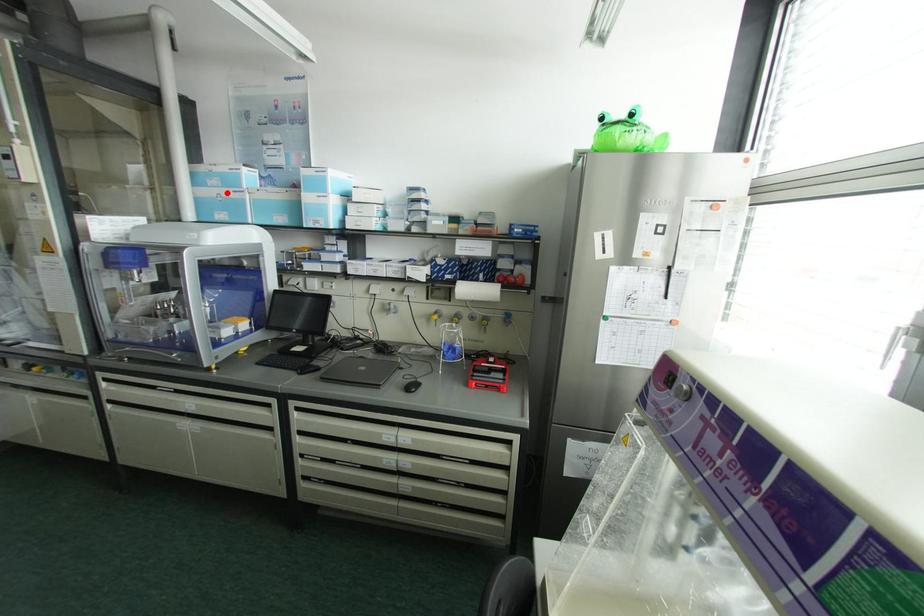
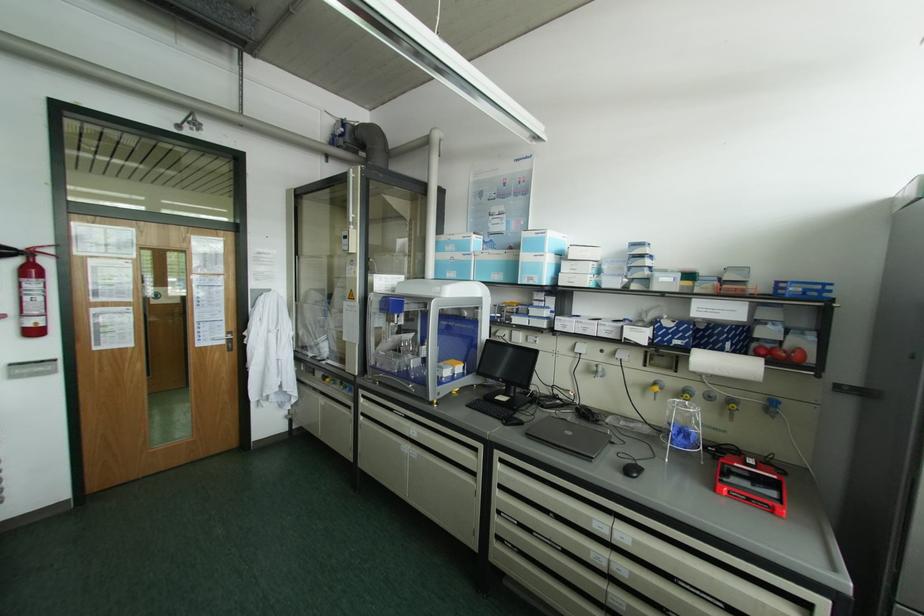
Locate, in the second image, the point that corresponds to the highlighted location in the first image.

(457, 256)